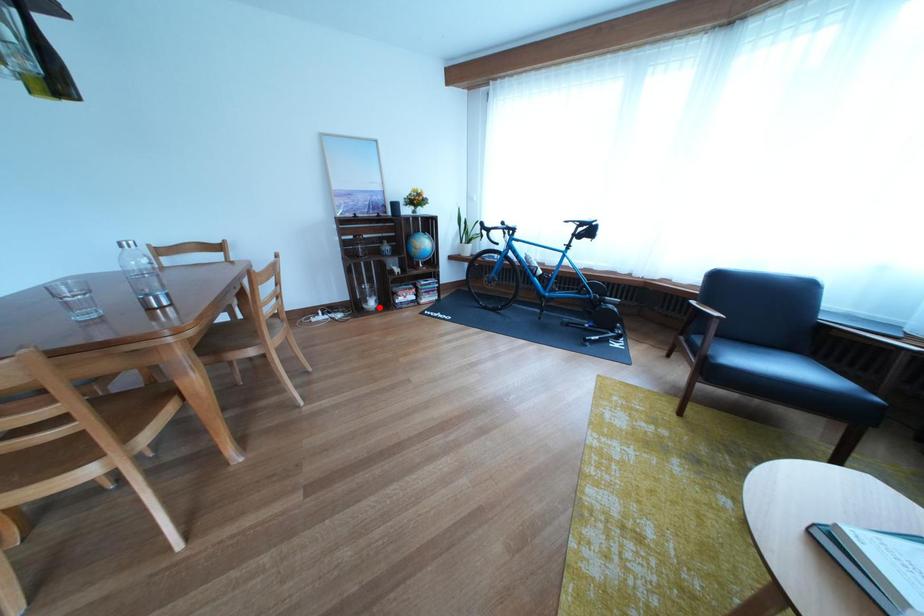
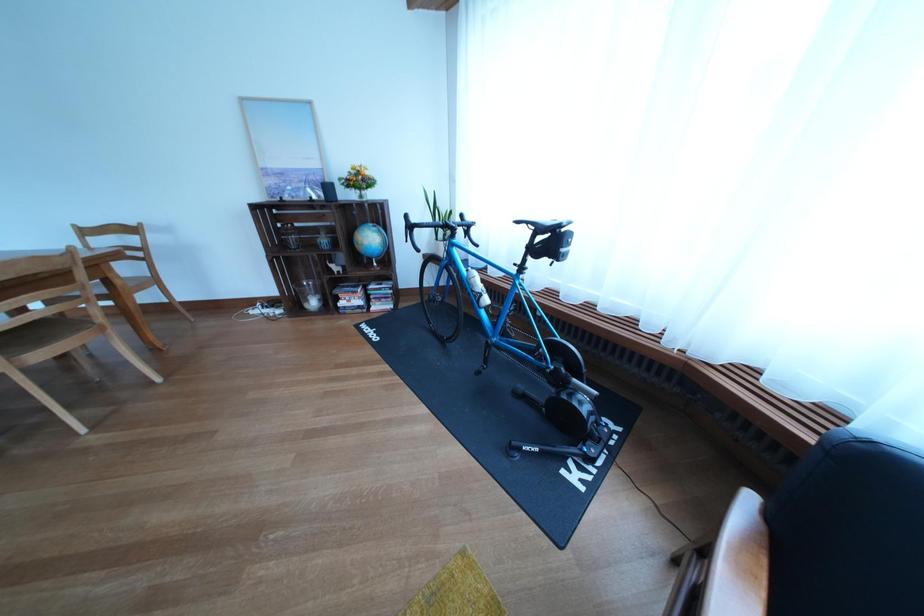
Question: A red point is marked in image1. In image2, is the corresponding 3D point closer to the camera or farther? Reply with the corresponding letter.

Choices:
 (A) The corresponding 3D point is closer.
 (B) The corresponding 3D point is farther.

Answer: (B)